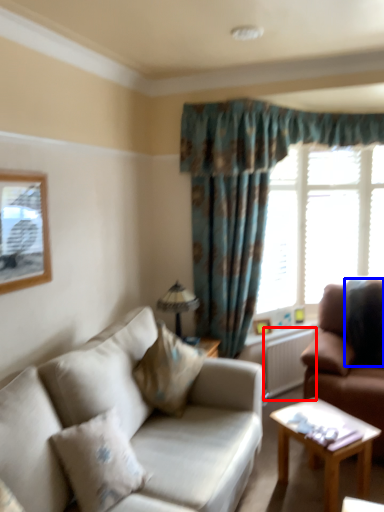
Question: Among these objects, which one is nearest to the camera, radiator (highlighted by a red box) or pillow (highlighted by a blue box)?

Choices:
 (A) radiator
 (B) pillow

Answer: (B)